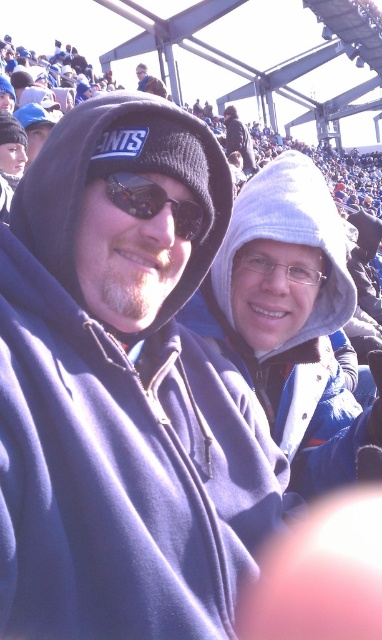
Question: Which object is closer to the camera taking this photo?

Choices:
 (A) white fleece hat at center
 (B) sunglasses at center

Answer: (B)

Question: Is sunglasses at center to the right of white fleece hat at center from the viewer's perspective?

Choices:
 (A) yes
 (B) no

Answer: (B)

Question: Can you confirm if clear plastic glasses at center is positioned above matte black beanie at upper center?

Choices:
 (A) no
 (B) yes

Answer: (A)

Question: Which of the following is the farthest from the observer?

Choices:
 (A) (145, 70)
 (B) (11, 230)
 (C) (236, 257)
 (D) (244, 129)

Answer: (A)

Question: Which of the following is the farthest from the observer?

Choices:
 (A) (157, 84)
 (B) (113, 188)
 (C) (228, 140)
 (D) (314, 272)

Answer: (C)

Question: Does clear plastic glasses at center have a lesser width compared to white fleece hat at center?

Choices:
 (A) no
 (B) yes

Answer: (B)